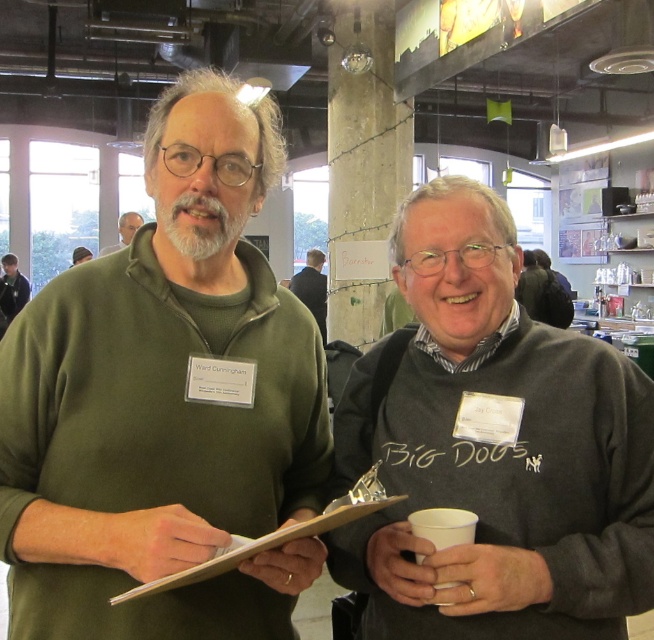
Question: Which is farther from the dark blue shirt at left?

Choices:
 (A) matte black sweater at center
 (B) black matte suit at center
 (C) dark gray sweater at center

Answer: (C)

Question: Can you confirm if green matte sweater at center is positioned to the left of black matte suit at center?

Choices:
 (A) yes
 (B) no

Answer: (B)

Question: Which of these objects is positioned closest to the dark gray sweater at center?

Choices:
 (A) matte green sweater at center
 (B) black matte suit at center
 (C) matte black sweater at center

Answer: (C)

Question: Is dark blue shirt at left in front of matte green sweater at center?

Choices:
 (A) no
 (B) yes

Answer: (A)

Question: Among these objects, which one is nearest to the camera?

Choices:
 (A) matte green sweater at center
 (B) dark gray sweater at center
 (C) green matte sweater at center

Answer: (C)

Question: Can you confirm if dark blue shirt at left is positioned to the right of matte green sweater at center?

Choices:
 (A) no
 (B) yes

Answer: (A)